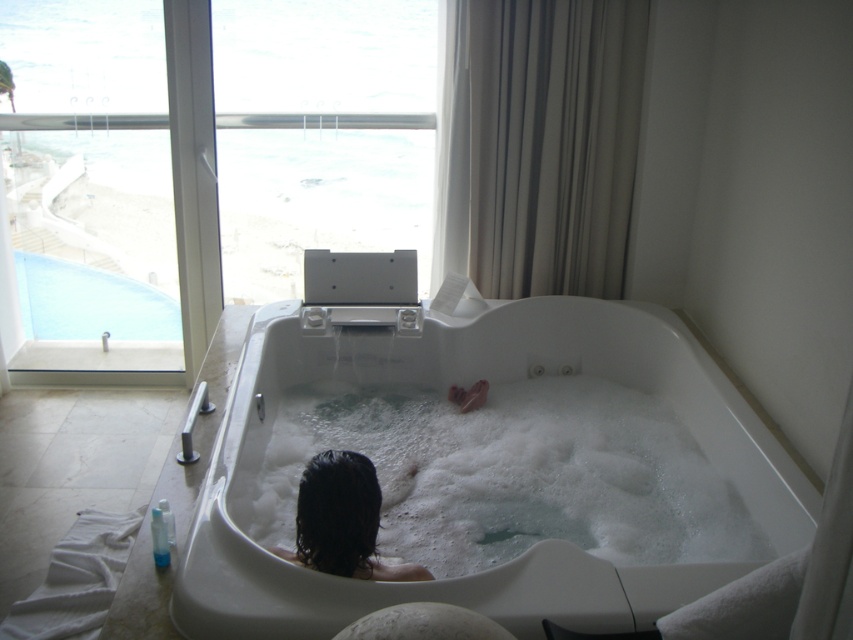
Who is more forward, (608, 625) or (772, 552)?

Point (608, 625) is in front.

Does white glossy jacuzzi at center appear on the left side of white foamy bath at center?

Yes, white glossy jacuzzi at center is to the left of white foamy bath at center.

The height and width of the screenshot is (640, 853). What do you see at coordinates (490, 392) in the screenshot?
I see `white glossy jacuzzi at center` at bounding box center [490, 392].

Identify the location of white glossy jacuzzi at center. The image size is (853, 640). (490, 392).

Is white glossy jacuzzi at center taller than transparent glass window at upper center?

In fact, white glossy jacuzzi at center may be shorter than transparent glass window at upper center.

Is point (521, 362) in front of point (245, 216)?

Yes, it is.

Who is more distant from viewer, (199, 573) or (280, 220)?

The point (280, 220) is more distant.

The width and height of the screenshot is (853, 640). What are the coordinates of `white glossy jacuzzi at center` in the screenshot? It's located at (490, 392).

This screenshot has width=853, height=640. Describe the element at coordinates (212, 180) in the screenshot. I see `transparent glass door at upper left` at that location.

Is transparent glass door at upper left smaller than white glossy jacuzzi at center?

No.

Between point (395, 182) and point (602, 337), which one is positioned behind?

The point (395, 182) is more distant.

The image size is (853, 640). I want to click on transparent glass door at upper left, so click(x=212, y=180).